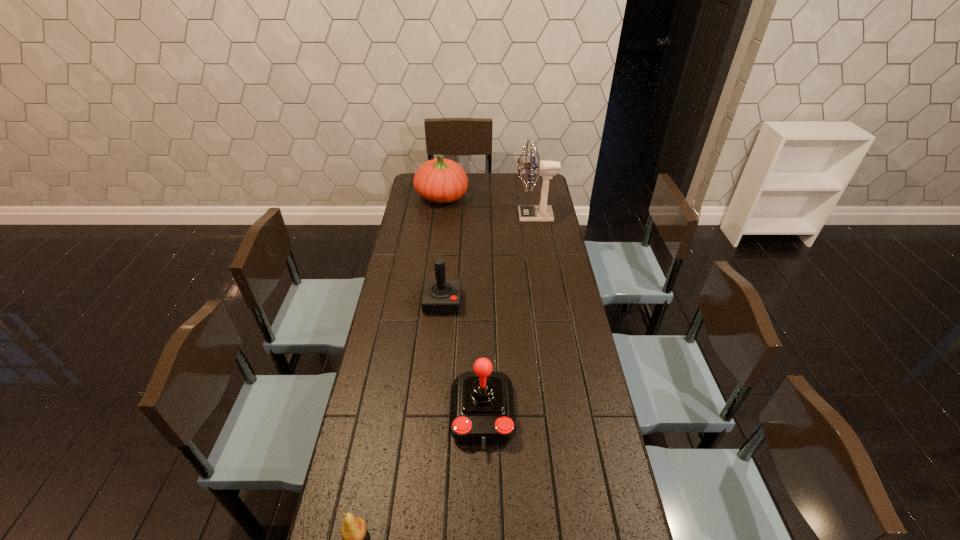
This screenshot has height=540, width=960. I want to click on vacant space that satisfies the following two spatial constraints: 1. on the front-facing side of the rightmost object; 2. on the base of the second nearest object, so click(x=568, y=415).

At what (x,y) coordinates should I click in order to perform the action: click on vacant region that satisfies the following two spatial constraints: 1. on the front-facing side of the rightmost object; 2. on the base of the third farthest object. Please return your answer as a coordinate pair (x, y). Looking at the image, I should click on (549, 302).